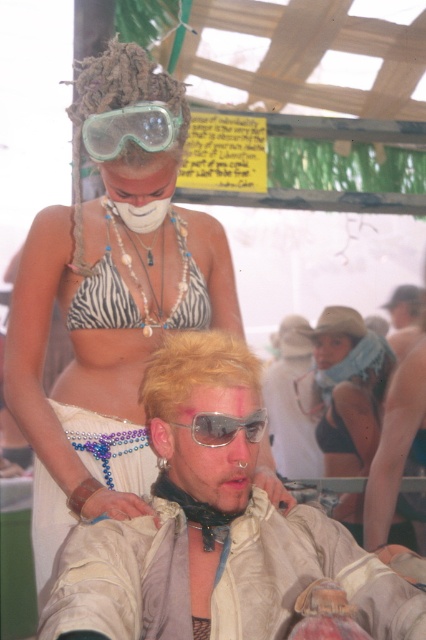
You are at a festival and see the matte khaki jacket at center and the sunglasses at center. Which object is located to the right of the other?

The matte khaki jacket at center is positioned on the right side of sunglasses at center.

In the scene shown: You are a photographer at the event and want to capture both the transparent plastic goggles at upper center and the white matte mask at center in a single photo. Which object should you focus on first to ensure both are in sharp focus?

You should focus on the transparent plastic goggles at upper center first because it is closer to the viewer than the white matte mask at center. By focusing on the closer object, the farther object will also be in focus due to the depth of field.

Based on the scene description, which object is positioned higher in the image between the sunglasses at center and the blondehair at center?

The sunglasses at center is taller than blondehair at center, so the sunglasses at center is positioned higher.